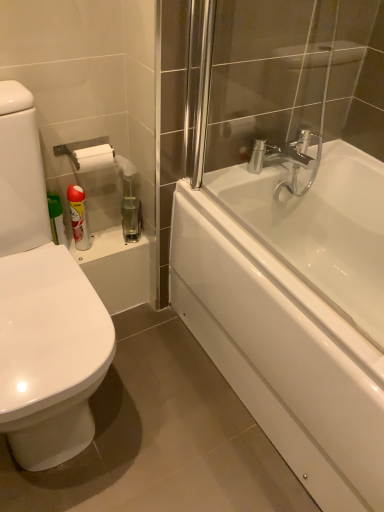
Question: From a real-world perspective, is translucent plastic spray bottle at upper left beneath white glossy bathtub at right?

Choices:
 (A) yes
 (B) no

Answer: (A)

Question: From the image's perspective, does translucent plastic spray bottle at upper left appear higher than white glossy bathtub at right?

Choices:
 (A) no
 (B) yes

Answer: (A)

Question: Considering the relative positions of translucent plastic spray bottle at upper left and white glossy bathtub at right in the image provided, is translucent plastic spray bottle at upper left to the left of white glossy bathtub at right from the viewer's perspective?

Choices:
 (A) yes
 (B) no

Answer: (A)

Question: Is translucent plastic spray bottle at upper left thinner than white glossy bathtub at right?

Choices:
 (A) no
 (B) yes

Answer: (A)

Question: Is translucent plastic spray bottle at upper left wider than white glossy bathtub at right?

Choices:
 (A) yes
 (B) no

Answer: (A)

Question: Considering their positions, is translucent plastic spray bottle at upper left located in front of or behind clear glass shower door at upper right?

Choices:
 (A) front
 (B) behind

Answer: (B)

Question: Is translucent plastic spray bottle at upper left situated inside clear glass shower door at upper right or outside?

Choices:
 (A) outside
 (B) inside

Answer: (A)

Question: Is translucent plastic spray bottle at upper left bigger or smaller than clear glass shower door at upper right?

Choices:
 (A) big
 (B) small

Answer: (B)

Question: Is point (127, 228) positioned closer to the camera than point (314, 87)?

Choices:
 (A) farther
 (B) closer

Answer: (A)

Question: From a real-world perspective, is white glossy bathtub at right above or below clear glass shower door at upper right?

Choices:
 (A) below
 (B) above

Answer: (A)

Question: Do you think white glossy bathtub at right is within clear glass shower door at upper right, or outside of it?

Choices:
 (A) inside
 (B) outside

Answer: (B)

Question: Is point (288, 439) closer or farther from the camera than point (347, 119)?

Choices:
 (A) farther
 (B) closer

Answer: (B)

Question: From their relative heights in the image, would you say white glossy bathtub at right is taller or shorter than clear glass shower door at upper right?

Choices:
 (A) tall
 (B) short

Answer: (B)

Question: From a real-world perspective, relative to translucent plastic spray bottle at upper left, is white glossy bathtub at right vertically above or below?

Choices:
 (A) below
 (B) above

Answer: (B)

Question: From their relative heights in the image, would you say white glossy bathtub at right is taller or shorter than translucent plastic spray bottle at upper left?

Choices:
 (A) short
 (B) tall

Answer: (B)